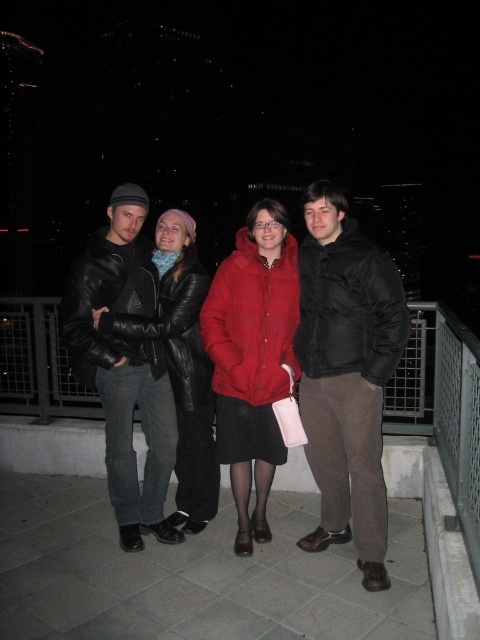
Who is positioned more to the left, black matte jacket at right or matte red coat at center?

Positioned to the left is matte red coat at center.

Is black matte jacket at right taller than matte red coat at center?

Yes.

The height and width of the screenshot is (640, 480). I want to click on black matte jacket at right, so click(347, 374).

Can you confirm if leather jacket at left is shorter than matte red coat at center?

No.

Is leather jacket at left above matte red coat at center?

Correct, leather jacket at left is located above matte red coat at center.

Who is more forward, [141,349] or [249,436]?

Point [141,349] is in front.

The image size is (480, 640). What are the coordinates of `leather jacket at left` in the screenshot? It's located at (123, 365).

Measure the distance from black matte jacket at right to leather jacket at left.

A distance of 37.31 inches exists between black matte jacket at right and leather jacket at left.

Which is above, black matte jacket at right or leather jacket at left?

Positioned higher is leather jacket at left.

Describe the element at coordinates (347, 374) in the screenshot. This screenshot has height=640, width=480. I see `black matte jacket at right` at that location.

Identify the location of black matte jacket at right. [347, 374].